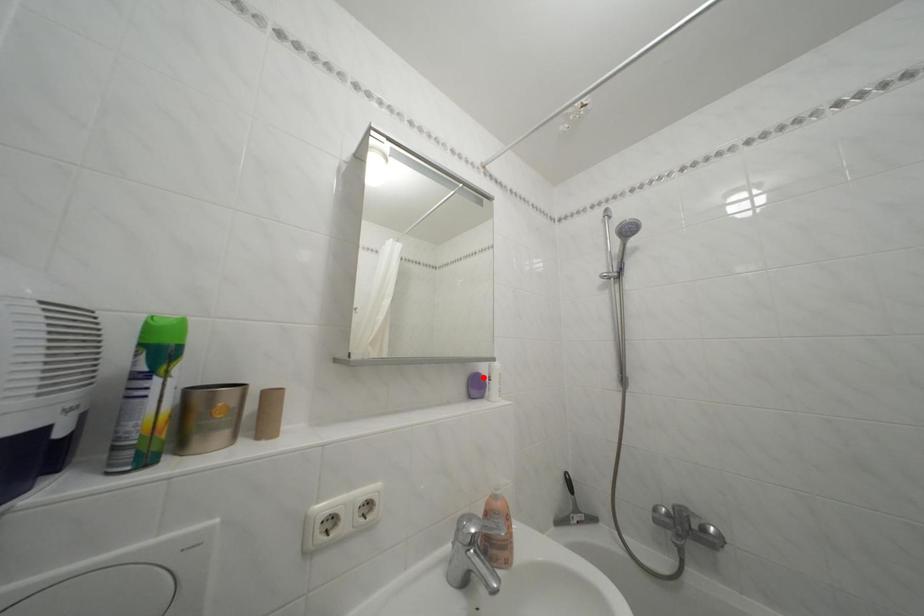
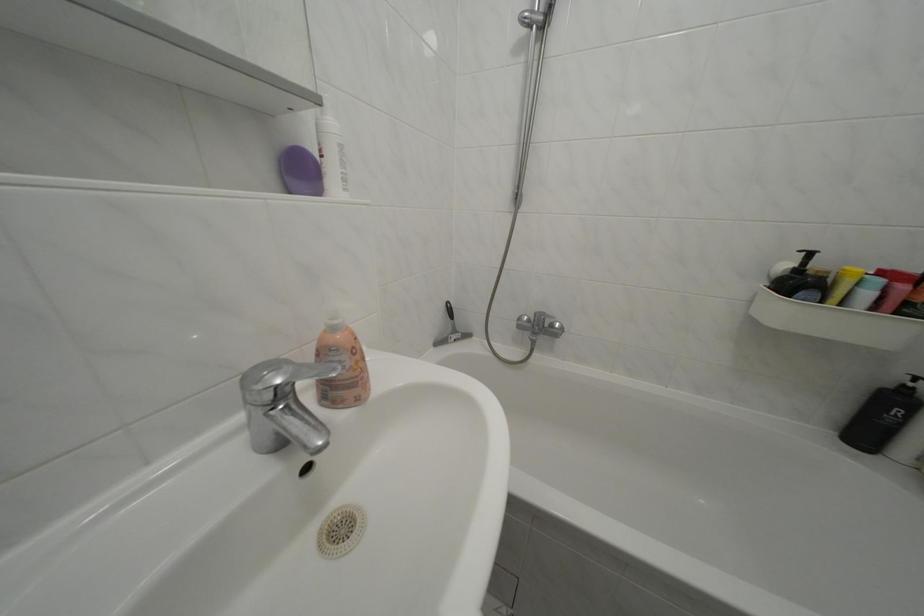
Find the pixel in the second image that matches the highlighted location in the first image.

(301, 150)